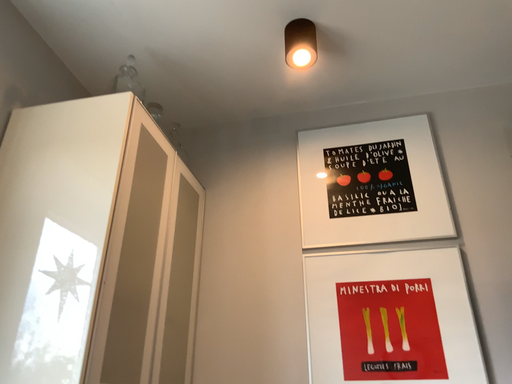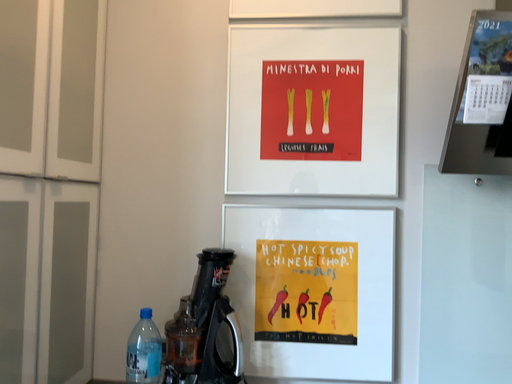
Question: Which way did the camera rotate in the video?

Choices:
 (A) rotated left
 (B) rotated right

Answer: (B)